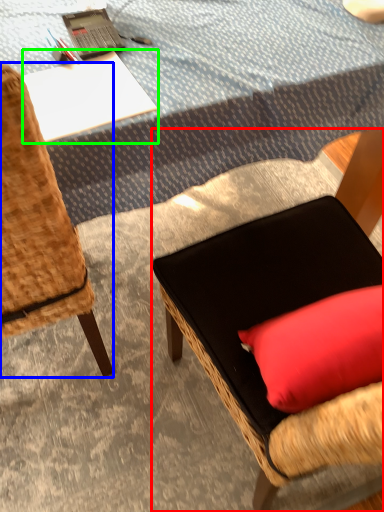
Question: Which object is positioned closest to chair (highlighted by a red box)? Select from chair (highlighted by a blue box) and desk (highlighted by a green box).

Choices:
 (A) chair
 (B) desk

Answer: (A)